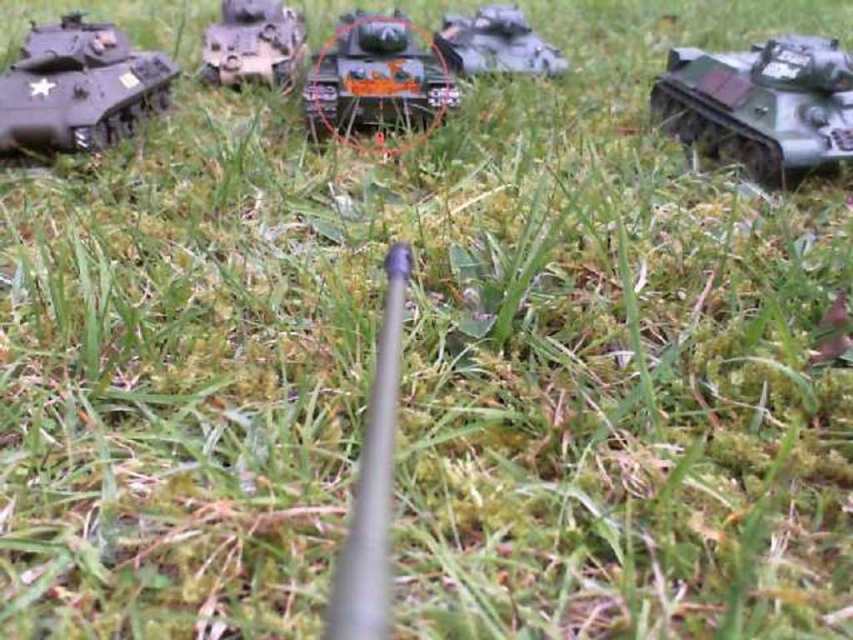
You are a child playing in the grassy area and want to arrange your tanks in a line from left to right. Given the current positions of the shiny orange tank at center and the green matte tank at center, which tank should you place first on the left side?

The shiny orange tank at center should be placed first on the left side because it is currently positioned to the left of the green matte tank at center.